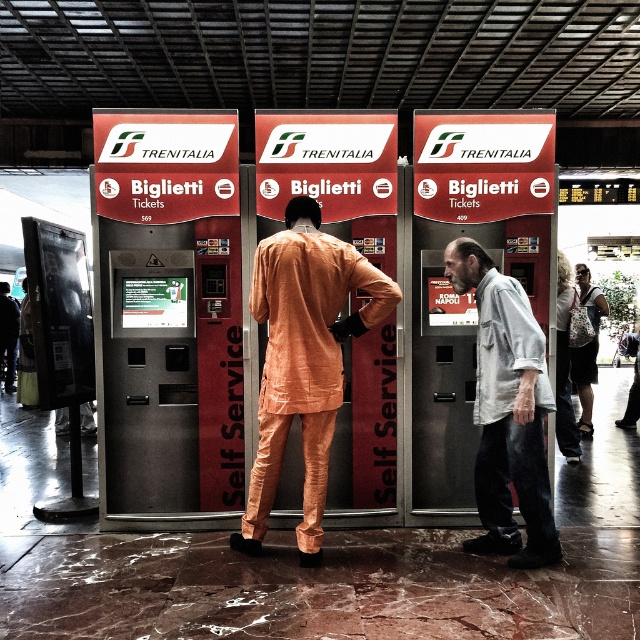
You are standing in the train station and see the metallic silver ticket machine at center and the orange fabric suit at center. Which object is closer to you?

The metallic silver ticket machine at center is closer to you than the orange fabric suit at center.

You are a passenger at the train station and need to buy a ticket. You see a red plastic vending machine at center and an orange fabric suit at center. Which one should you interact with to purchase your ticket?

The red plastic vending machine at center is located above the orange fabric suit at center, so you should interact with the red plastic vending machine at center to purchase your ticket since vending machines are typically used for buying tickets.

You are a person who just arrived at the train station and need to buy a ticket. You see a red plastic vending machine at center and a light gray cotton shirt at right. Which object is taller?

The red plastic vending machine at center is much taller than the light gray cotton shirt at right.